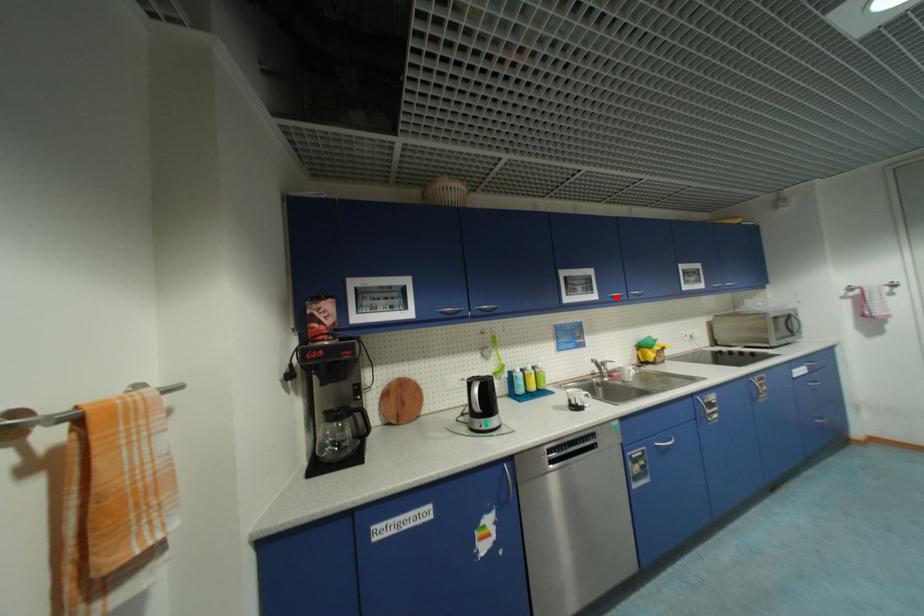
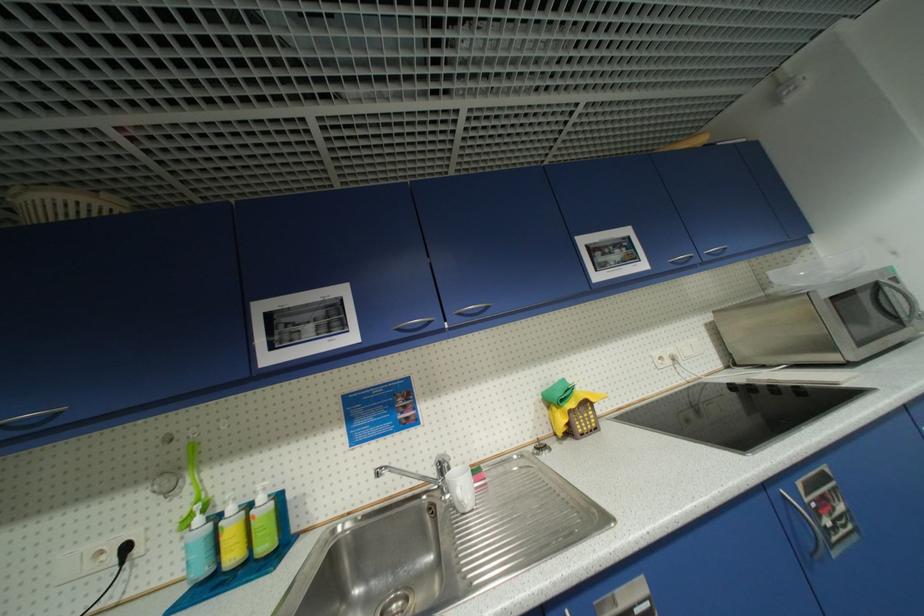
Find the pixel in the second image that matches the highlighted location in the first image.

(405, 331)